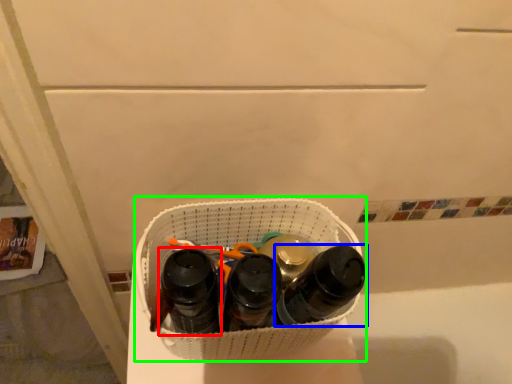
Question: Which object is the farthest from footwear (highlighted by a red box)? Choose among these: footwear (highlighted by a blue box) or laundry basket (highlighted by a green box).

Choices:
 (A) footwear
 (B) laundry basket

Answer: (A)